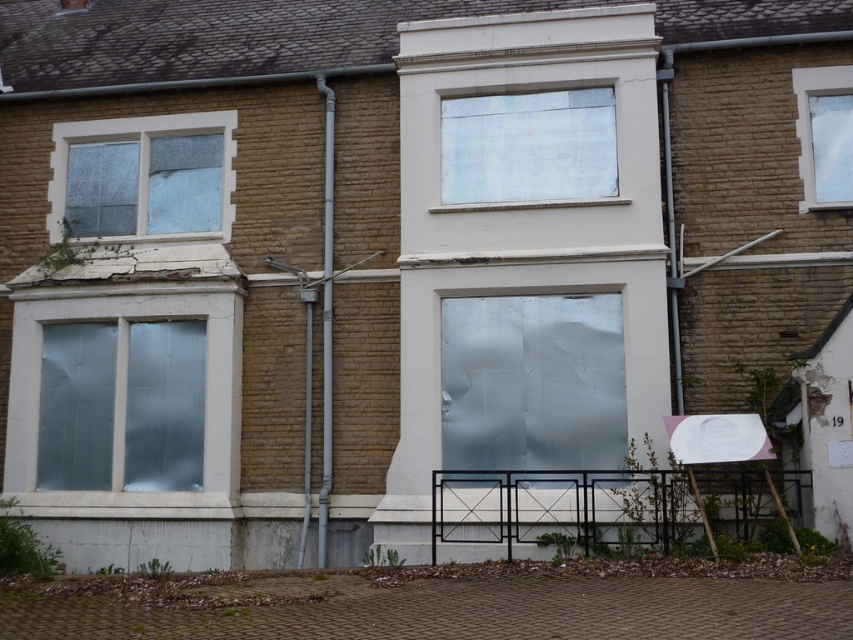
Which is behind, point (550, 371) or point (608, 179)?

The point (608, 179) is more distant.

Can you confirm if frosted glass window at center is positioned above transparent glass window at upper center?

No, frosted glass window at center is not above transparent glass window at upper center.

Is point (527, 456) in front of point (521, 173)?

Yes, point (527, 456) is closer to viewer.

Identify the location of frosted glass window at center. The height and width of the screenshot is (640, 853). (532, 381).

Which of these two, frosted glass window at lower left or clear glass window at upper right, stands taller?

frosted glass window at lower left is taller.

Consider the image. Which is below, frosted glass window at lower left or clear glass window at upper right?

frosted glass window at lower left is lower down.

This screenshot has width=853, height=640. Find the location of `frosted glass window at lower left`. frosted glass window at lower left is located at coordinates (125, 387).

Who is taller, frosted glass window at center or frosted glass window at lower left?

frosted glass window at lower left is taller.

The image size is (853, 640). Identify the location of frosted glass window at center. coord(532,381).

Where is `frosted glass window at center`? The width and height of the screenshot is (853, 640). frosted glass window at center is located at coordinates (532, 381).